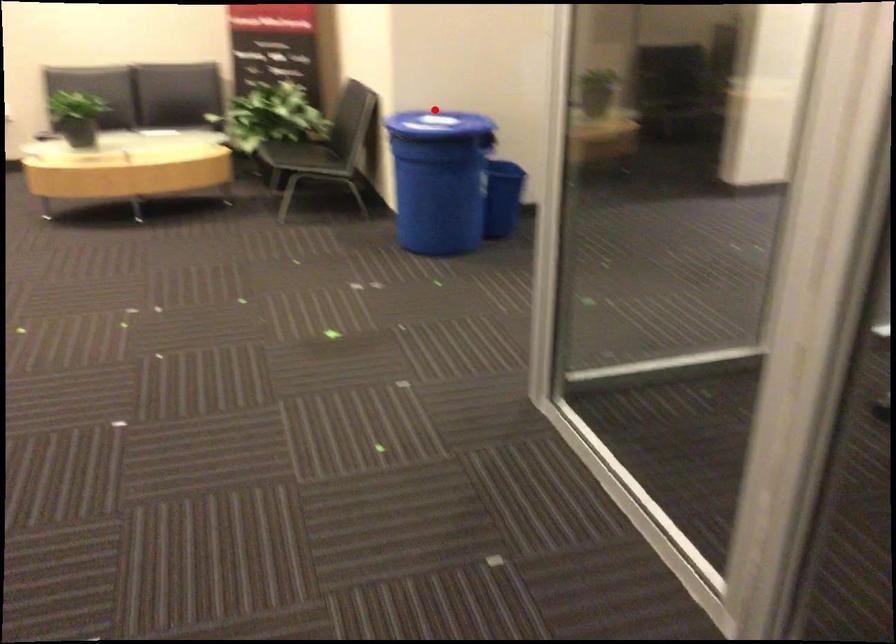
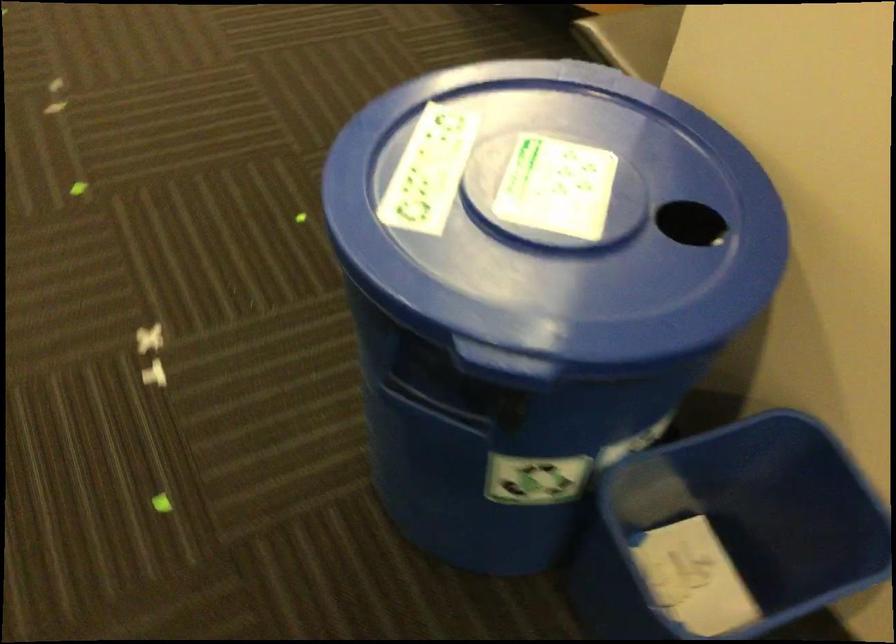
In the second image, find the point that corresponds to the highlighted location in the first image.

(556, 187)